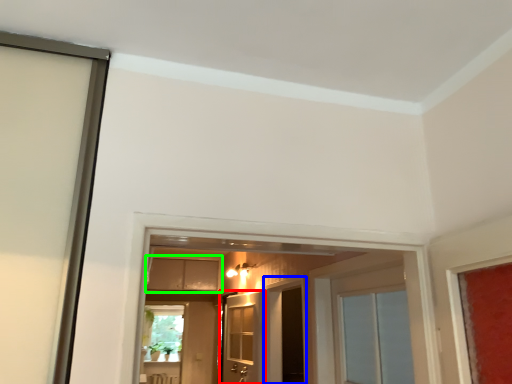
Question: Based on their relative distances, which object is farther from door (highlighted by a red box)? Choose from screen door (highlighted by a blue box) and cabinetry (highlighted by a green box).

Choices:
 (A) screen door
 (B) cabinetry

Answer: (B)